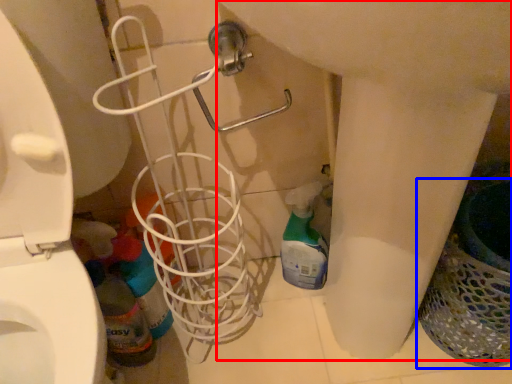
Question: Which object appears farthest to the camera in this image, sink (highlighted by a red box) or laundry basket (highlighted by a blue box)?

Choices:
 (A) sink
 (B) laundry basket

Answer: (B)